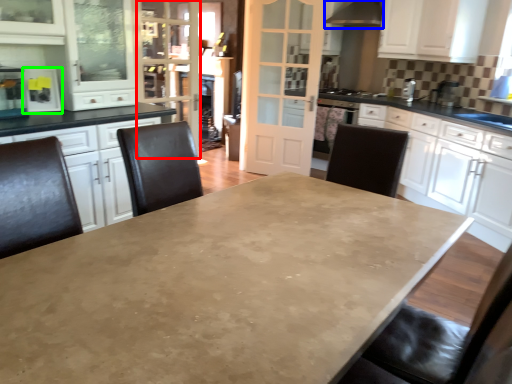
Question: Considering the real-world distances, which object is closest to glass door (highlighted by a red box)? exhaust hood (highlighted by a blue box) or appliance (highlighted by a green box).

Choices:
 (A) exhaust hood
 (B) appliance

Answer: (B)